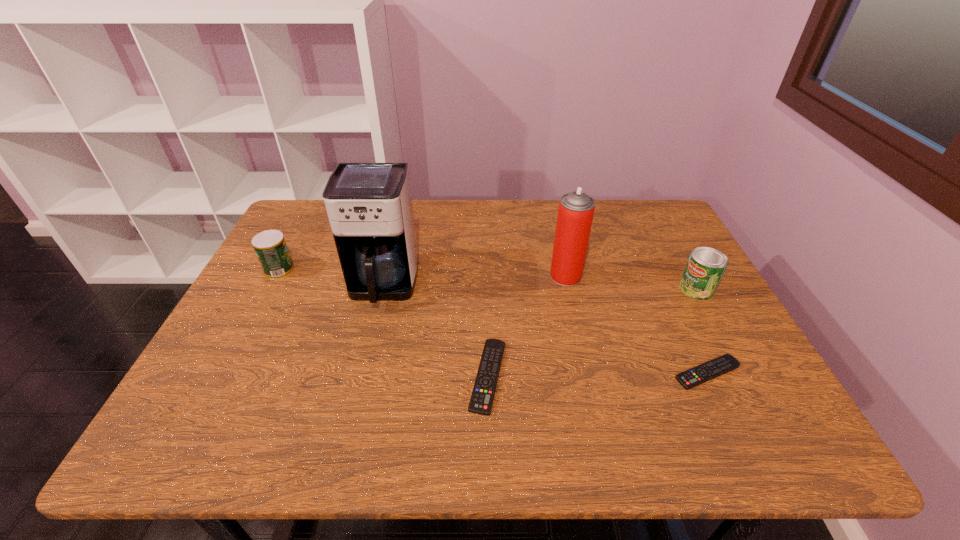
Where is `vacant space that satisfies the following two spatial constraints: 1. on the front side of the shorter remote control; 2. on the right side of the aerosol can`? This screenshot has height=540, width=960. vacant space that satisfies the following two spatial constraints: 1. on the front side of the shorter remote control; 2. on the right side of the aerosol can is located at coordinates (588, 373).

The image size is (960, 540). I want to click on free location that satisfies the following two spatial constraints: 1. on the front side of the fourth object from right to left; 2. on the left side of the leftmost object, so click(223, 376).